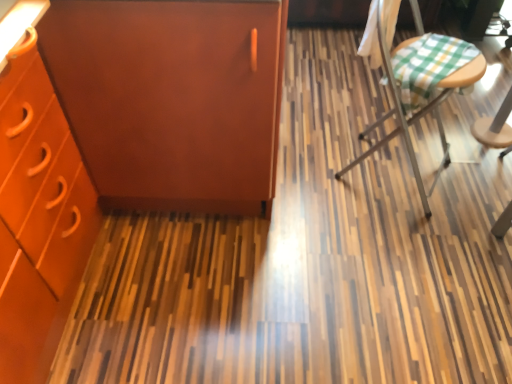
Question: Is green checkered fabric at right bigger than matte orange cabinet at upper left?

Choices:
 (A) no
 (B) yes

Answer: (A)

Question: From a real-world perspective, is green checkered fabric at right below matte orange cabinet at upper left?

Choices:
 (A) yes
 (B) no

Answer: (A)

Question: Is green checkered fabric at right looking in the opposite direction of matte orange cabinet at upper left?

Choices:
 (A) no
 (B) yes

Answer: (B)

Question: From the image's perspective, is green checkered fabric at right on matte orange cabinet at upper left?

Choices:
 (A) no
 (B) yes

Answer: (B)

Question: Is green checkered fabric at right far from matte orange cabinet at upper left?

Choices:
 (A) yes
 (B) no

Answer: (B)

Question: Is green checkered fabric at right facing towards matte orange cabinet at upper left?

Choices:
 (A) no
 (B) yes

Answer: (A)

Question: Is green checkered fabric at right positioned beyond the bounds of matte brown cabinet at left?

Choices:
 (A) no
 (B) yes

Answer: (B)

Question: Can you confirm if green checkered fabric at right is bigger than matte brown cabinet at left?

Choices:
 (A) yes
 (B) no

Answer: (B)

Question: From the image's perspective, is green checkered fabric at right located above matte brown cabinet at left?

Choices:
 (A) no
 (B) yes

Answer: (A)

Question: Does green checkered fabric at right have a lesser width compared to matte brown cabinet at left?

Choices:
 (A) no
 (B) yes

Answer: (B)

Question: Is green checkered fabric at right shorter than matte brown cabinet at left?

Choices:
 (A) no
 (B) yes

Answer: (B)

Question: Is green checkered fabric at right behind matte brown cabinet at left?

Choices:
 (A) yes
 (B) no

Answer: (A)

Question: Considering the relative sizes of matte orange cabinet at upper left and matte brown cabinet at left in the image provided, is matte orange cabinet at upper left bigger than matte brown cabinet at left?

Choices:
 (A) no
 (B) yes

Answer: (B)